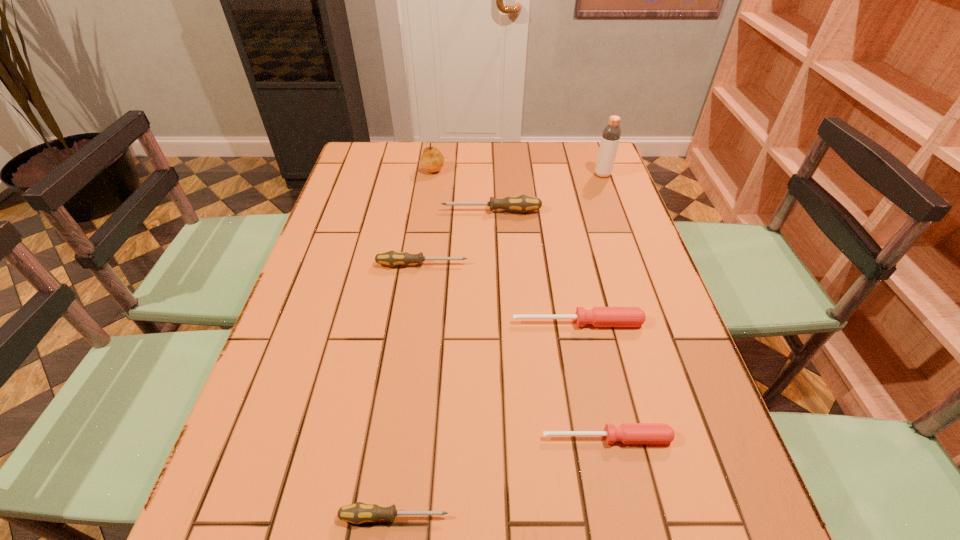
Identify the location of gray bottle. The image size is (960, 540). (611, 133).

The height and width of the screenshot is (540, 960). In order to click on the rightmost object in this screenshot , I will do (x=611, y=133).

Identify the location of pear. (432, 160).

Find the location of a particular element. The width and height of the screenshot is (960, 540). the farthest gray screwdriver is located at coordinates (523, 203).

The image size is (960, 540). Find the location of `the third tallest object`. the third tallest object is located at coordinates (523, 203).

You are a GUI agent. You are given a task and a screenshot of the screen. Output one action in this format:
    pyautogui.click(x=<x>, y=<y>)
    Task: Click on the fourth farthest object
    The image size is (960, 540).
    Given the screenshot: What is the action you would take?
    pyautogui.click(x=392, y=258)

Where is `the second nearest gray screwdriver`? the second nearest gray screwdriver is located at coordinates (392, 258).

At what (x,y) coordinates should I click in order to perform the action: click on the third farthest screwdriver. Please return your answer as a coordinate pair (x, y). Looking at the image, I should click on (598, 316).

The image size is (960, 540). Find the location of `the bigger red screwdriver`. the bigger red screwdriver is located at coordinates (598, 316).

The image size is (960, 540). Find the location of `the second nearest object`. the second nearest object is located at coordinates (628, 433).